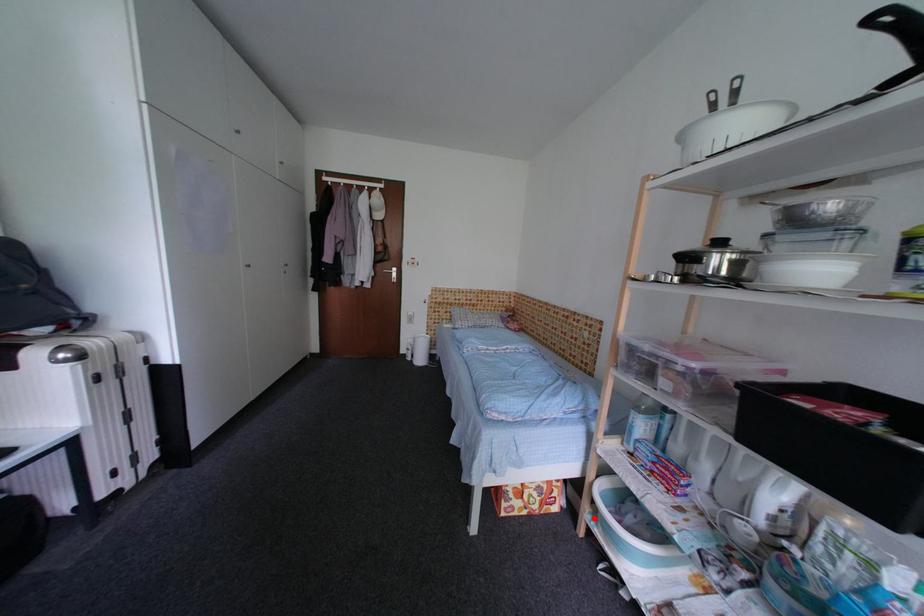
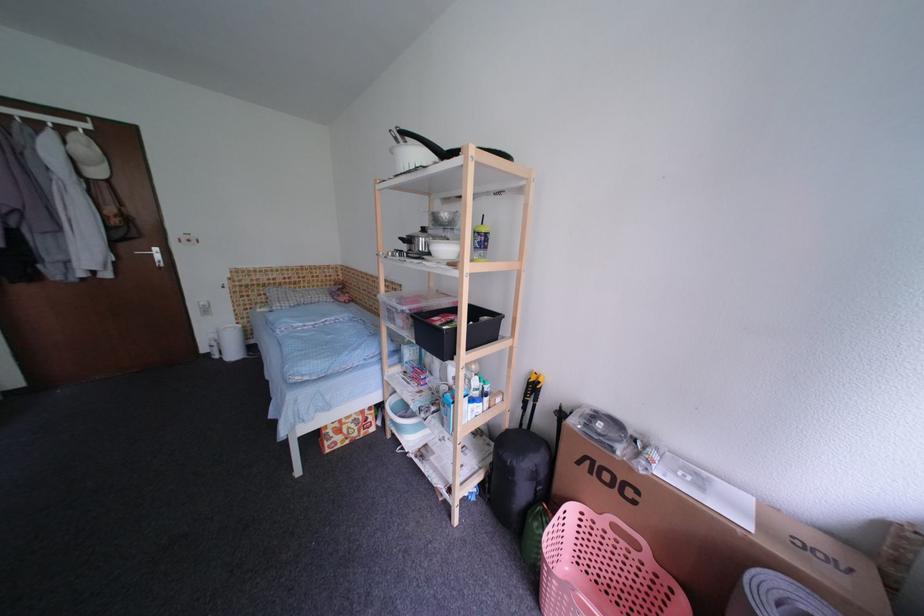
In the second image, find the point that corresponds to the highlighted location in the first image.

(395, 426)